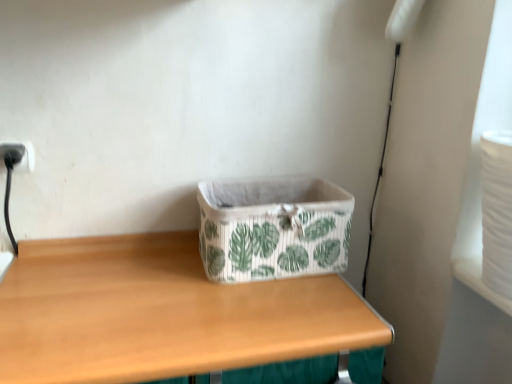
The width and height of the screenshot is (512, 384). In order to click on free space in front of white fabric storage box at center in this screenshot , I will do tap(255, 320).